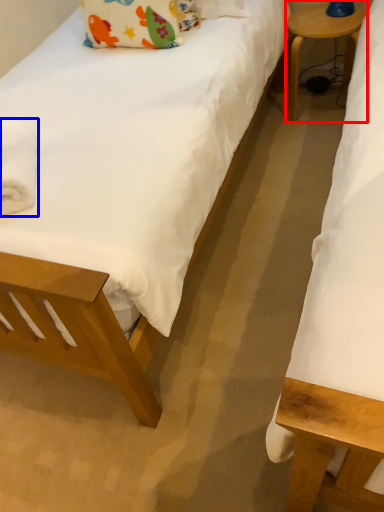
Question: Which object appears closest to the camera in this image, table (highlighted by a red box) or material (highlighted by a blue box)?

Choices:
 (A) table
 (B) material

Answer: (B)